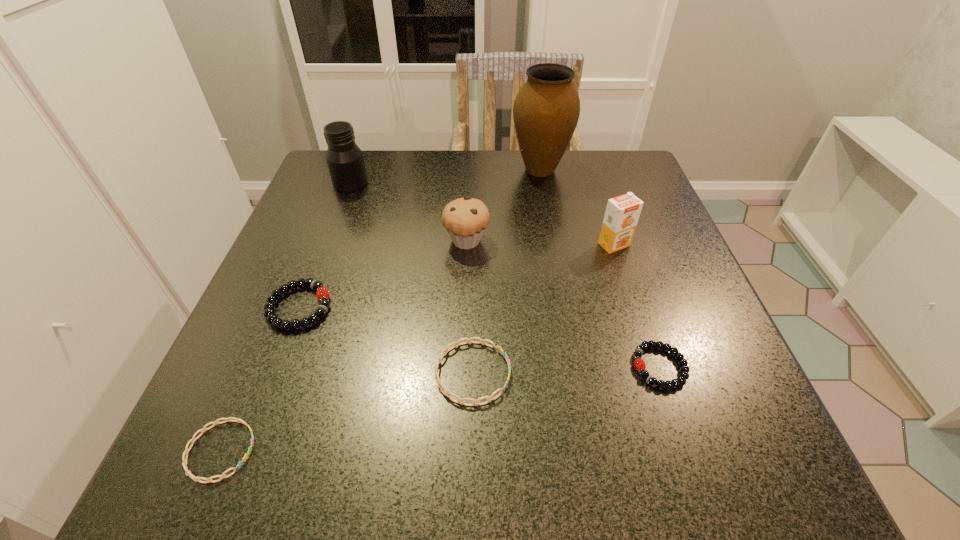
You are a GUI agent. You are given a task and a screenshot of the screen. Output one action in this format:
    pyautogui.click(x=<x>, y=<y>)
    Task: Click on the empty location between the orange orange juice and the farther blue bracelet
    
    Given the screenshot: What is the action you would take?
    pyautogui.click(x=543, y=308)

Identify the location of free space between the fifth shortest object and the brown urn. (503, 205).

Locate an element on the screen. free point between the seventh shortest object and the nearer black bracelet is located at coordinates (505, 275).

This screenshot has width=960, height=540. Identify the location of free space between the nearest object and the tallest object. (380, 310).

This screenshot has height=540, width=960. What are the coordinates of `unoccupied position between the nearest bracelet and the second bracelet from right to left` in the screenshot? It's located at (347, 411).

The height and width of the screenshot is (540, 960). I want to click on empty space between the right blue bracelet and the orange juice, so click(543, 308).

Locate an element on the screen. The height and width of the screenshot is (540, 960). vacant area that lies between the farther blue bracelet and the shortest bracelet is located at coordinates (347, 411).

The height and width of the screenshot is (540, 960). In order to click on object that ranks as the fifth closest to the jar in this screenshot , I will do `click(622, 213)`.

The width and height of the screenshot is (960, 540). I want to click on object that is the third closest to the bigger black bracelet, so click(465, 219).

Locate an element on the screen. the third closest bracelet to the left blue bracelet is located at coordinates (639, 364).